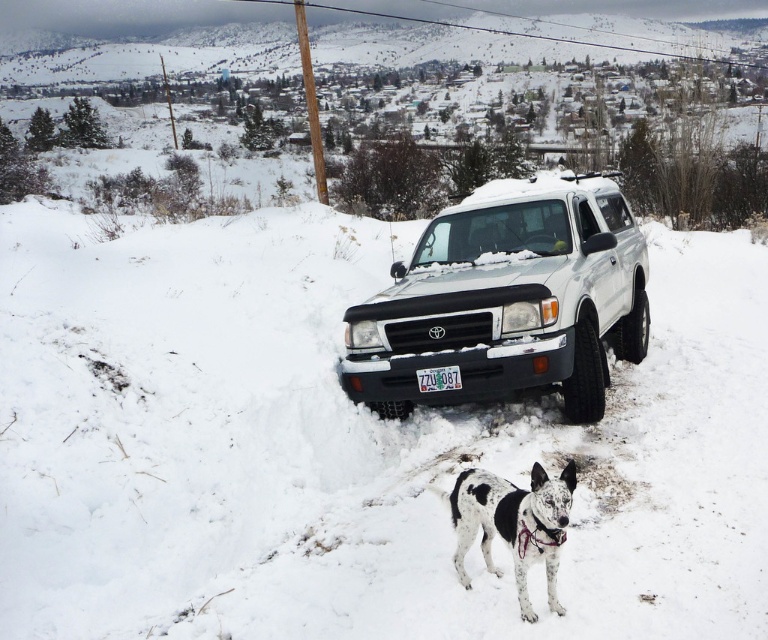
Can you confirm if spotted fur dog at center is smaller than white plastic license plate at center?

Actually, spotted fur dog at center might be larger than white plastic license plate at center.

Which is in front, point (535, 612) or point (447, 369)?

Point (535, 612)

Image resolution: width=768 pixels, height=640 pixels. Identify the location of spotted fur dog at center. (515, 524).

Where is `spotted fur dog at center`? The height and width of the screenshot is (640, 768). spotted fur dog at center is located at coordinates (515, 524).

From the picture: Is white matte suv at center taller than spotted fur dog at center?

Correct, white matte suv at center is much taller as spotted fur dog at center.

Who is positioned more to the right, white matte suv at center or spotted fur dog at center?

spotted fur dog at center is more to the right.

Who is more forward, (545,256) or (492,488)?

Positioned in front is point (492,488).

The width and height of the screenshot is (768, 640). What are the coordinates of `white matte suv at center` in the screenshot? It's located at (507, 300).

Does white matte suv at center appear on the right side of white plastic license plate at center?

Indeed, white matte suv at center is positioned on the right side of white plastic license plate at center.

Is point (454, 300) positioned behind point (454, 365)?

No, it is not.

This screenshot has height=640, width=768. I want to click on white matte suv at center, so click(507, 300).